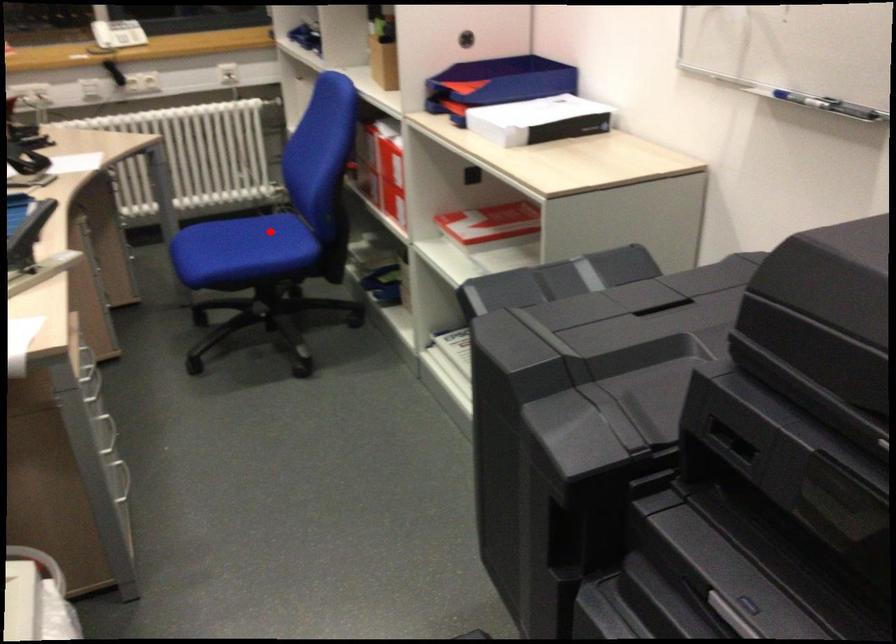
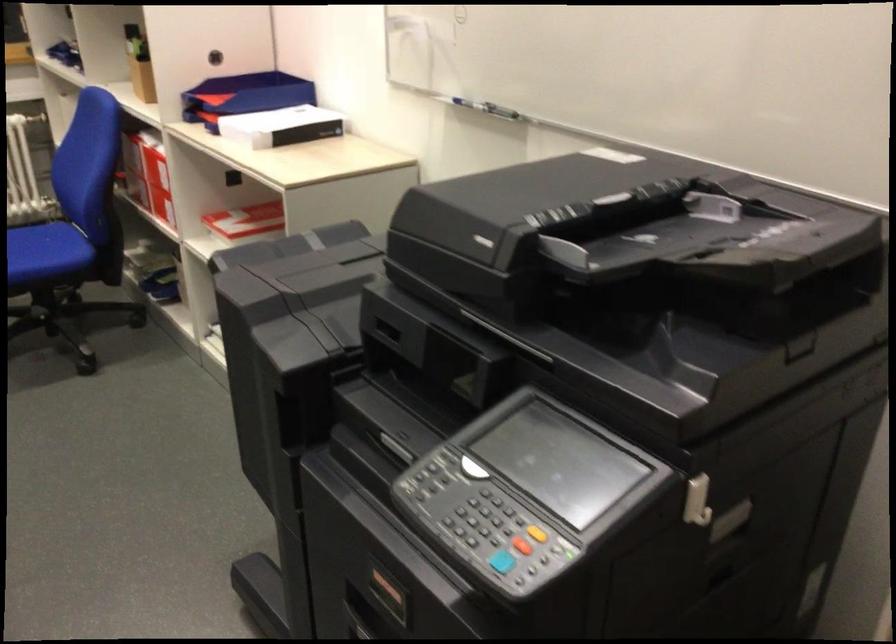
Locate, in the second image, the point that corresponds to the highlighted location in the first image.

(42, 243)